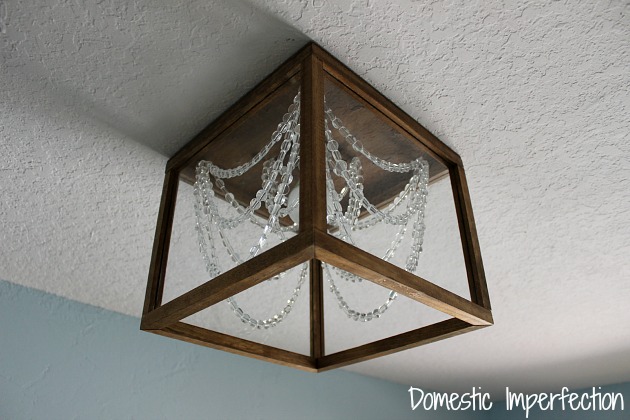
Image resolution: width=630 pixels, height=420 pixels. What are the coordinates of `chandelier` in the screenshot? It's located at (350, 199).